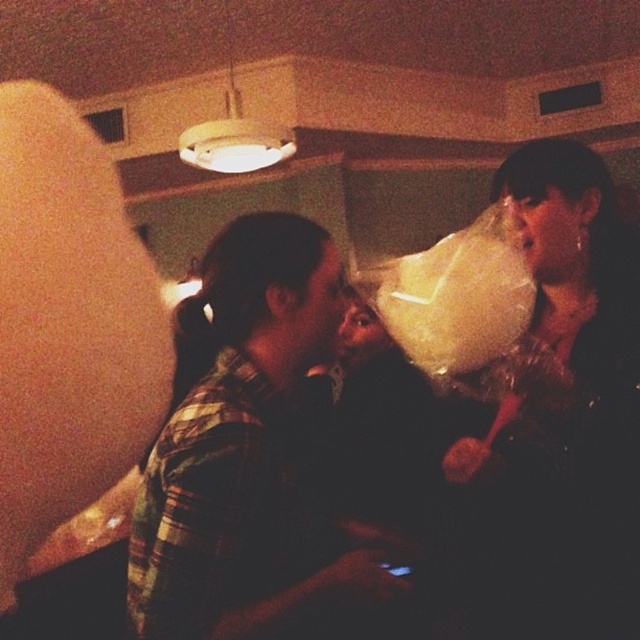
Which is below, plaid shirt at center or white fluffy cotton candy at upper right?

plaid shirt at center

Who is positioned more to the left, plaid shirt at center or white fluffy cotton candy at upper right?

From the viewer's perspective, plaid shirt at center appears more on the left side.

The image size is (640, 640). I want to click on plaid shirt at center, so click(248, 452).

Is plaid shirt at center wider than green plaid shirt at center?

Yes, plaid shirt at center is wider than green plaid shirt at center.

Between point (282, 388) and point (202, 618), which one is positioned in front?

Point (202, 618) is more forward.

This screenshot has width=640, height=640. I want to click on plaid shirt at center, so click(248, 452).

Find the location of a particular element. This screenshot has height=640, width=640. plaid shirt at center is located at coordinates (x=248, y=452).

Between green plaid shirt at center and white fluffy cotton candy at upper right, which one is positioned higher?

white fluffy cotton candy at upper right is above.

Is point (244, 525) closer to camera compared to point (545, 474)?

Yes, point (244, 525) is in front of point (545, 474).

The height and width of the screenshot is (640, 640). I want to click on green plaid shirt at center, so click(x=243, y=445).